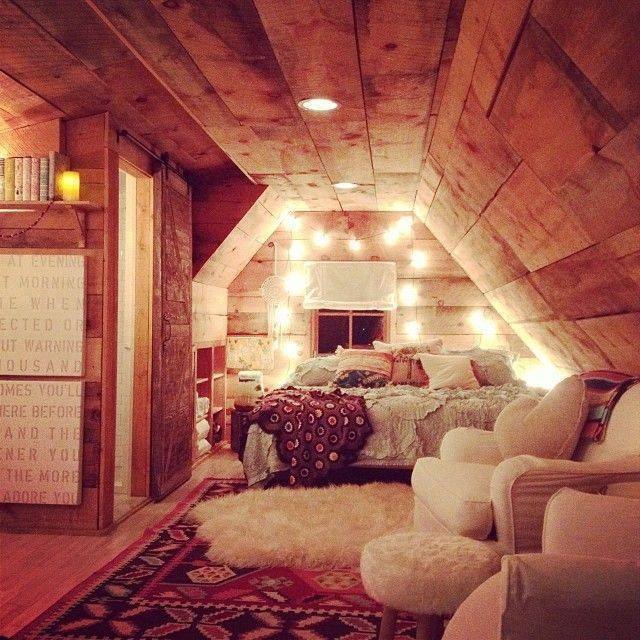
Find the location of a particular element. The image size is (640, 640). rug is located at coordinates [x=145, y=576].